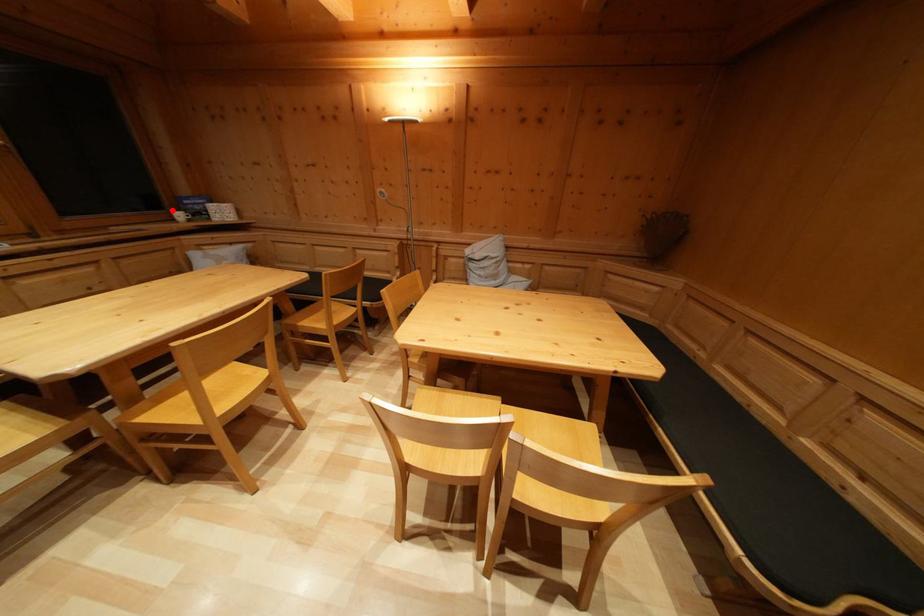
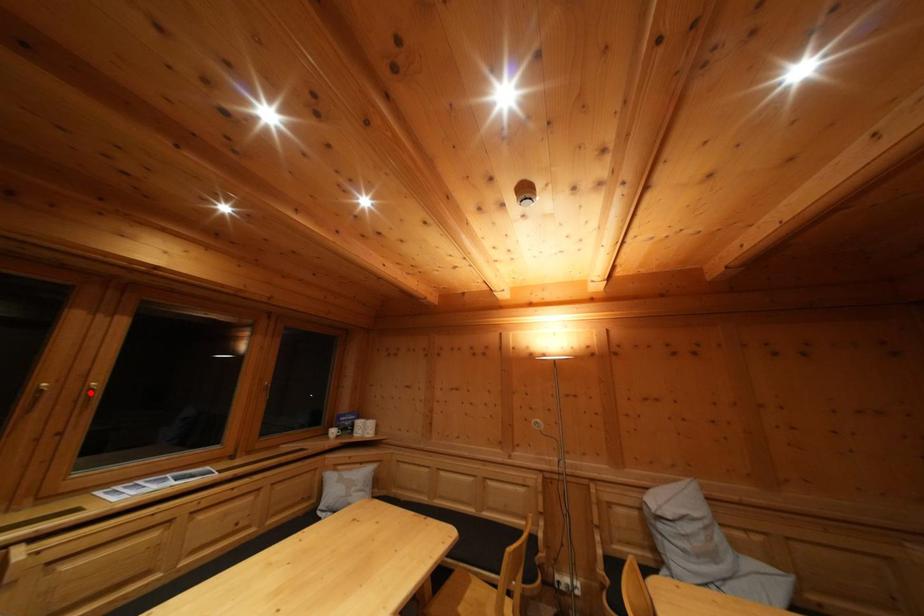
I am providing you with two images of the same scene from different viewpoints. A red point is marked on the first image and another point is marked on the second image. Is the marked point in image1 the same physical position as the marked point in image2?

No